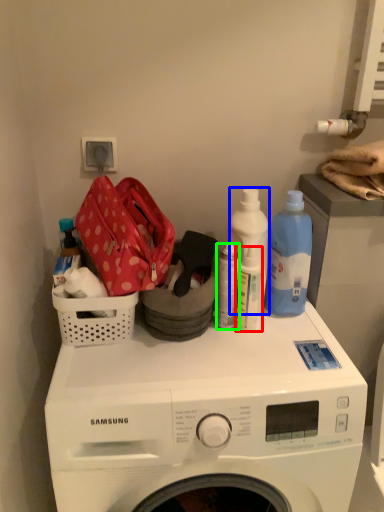
Question: Which object is the farthest from cleaning product (highlighted by a red box)? Choose among these: cleaning product (highlighted by a blue box) or bottle (highlighted by a green box).

Choices:
 (A) cleaning product
 (B) bottle

Answer: (A)